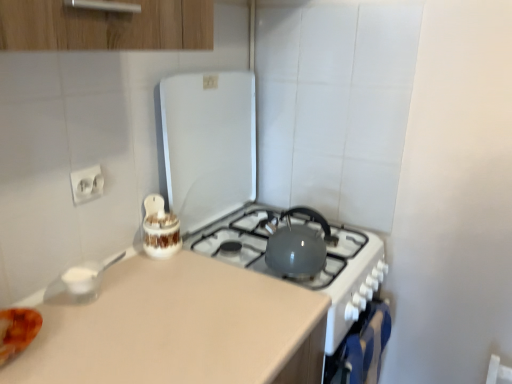
Question: Is blue fabric oven at lower right shorter than white glossy electric outlet at upper left?

Choices:
 (A) no
 (B) yes

Answer: (A)

Question: Can you confirm if blue fabric oven at lower right is wider than white glossy electric outlet at upper left?

Choices:
 (A) no
 (B) yes

Answer: (B)

Question: Are blue fabric oven at lower right and white glossy electric outlet at upper left far apart?

Choices:
 (A) yes
 (B) no

Answer: (B)

Question: Is blue fabric oven at lower right aimed at white glossy electric outlet at upper left?

Choices:
 (A) no
 (B) yes

Answer: (A)

Question: Is blue fabric oven at lower right behind white glossy electric outlet at upper left?

Choices:
 (A) no
 (B) yes

Answer: (B)

Question: Considering the relative positions of blue fabric oven at lower right and matte gray kettle at center, placed as the second appliance when sorted from left to right, in the image provided, is blue fabric oven at lower right to the left or to the right of matte gray kettle at center, placed as the second appliance when sorted from left to right,?

Choices:
 (A) left
 (B) right

Answer: (B)

Question: Is blue fabric oven at lower right inside or outside of matte gray kettle at center, acting as the first appliance starting from the right?

Choices:
 (A) inside
 (B) outside

Answer: (B)

Question: Is blue fabric oven at lower right in front of or behind matte gray kettle at center, acting as the first appliance starting from the right, in the image?

Choices:
 (A) front
 (B) behind

Answer: (B)

Question: From a real-world perspective, is blue fabric oven at lower right above or below matte gray kettle at center, placed as the second appliance when sorted from left to right?

Choices:
 (A) above
 (B) below

Answer: (B)

Question: Is white glossy electric outlet at upper left wider or thinner than matte gray kettle at center, acting as the first appliance starting from the right?

Choices:
 (A) thin
 (B) wide

Answer: (A)

Question: From a real-world perspective, is white glossy electric outlet at upper left physically located above or below matte gray kettle at center, placed as the second appliance when sorted from left to right?

Choices:
 (A) below
 (B) above

Answer: (B)

Question: Is white glossy electric outlet at upper left in front of or behind matte gray kettle at center, acting as the first appliance starting from the right, in the image?

Choices:
 (A) front
 (B) behind

Answer: (B)

Question: Is white glossy electric outlet at upper left bigger or smaller than matte gray kettle at center, acting as the first appliance starting from the right?

Choices:
 (A) small
 (B) big

Answer: (A)

Question: Is matte gray kettle at center, placed as the second appliance when sorted from left to right, to the left or to the right of blue fabric oven at lower right in the image?

Choices:
 (A) right
 (B) left

Answer: (B)

Question: Does point (195, 119) appear closer or farther from the camera than point (389, 332)?

Choices:
 (A) farther
 (B) closer

Answer: (B)